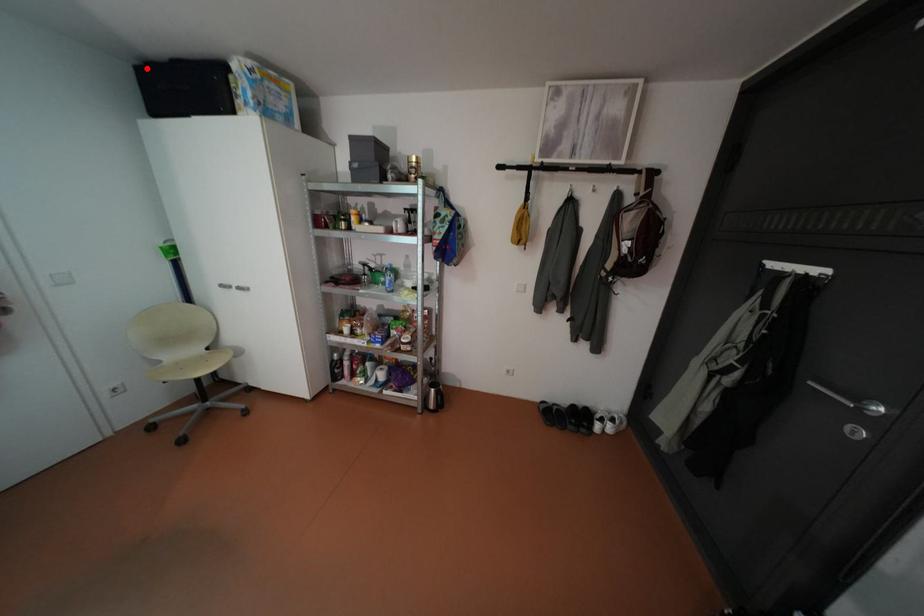
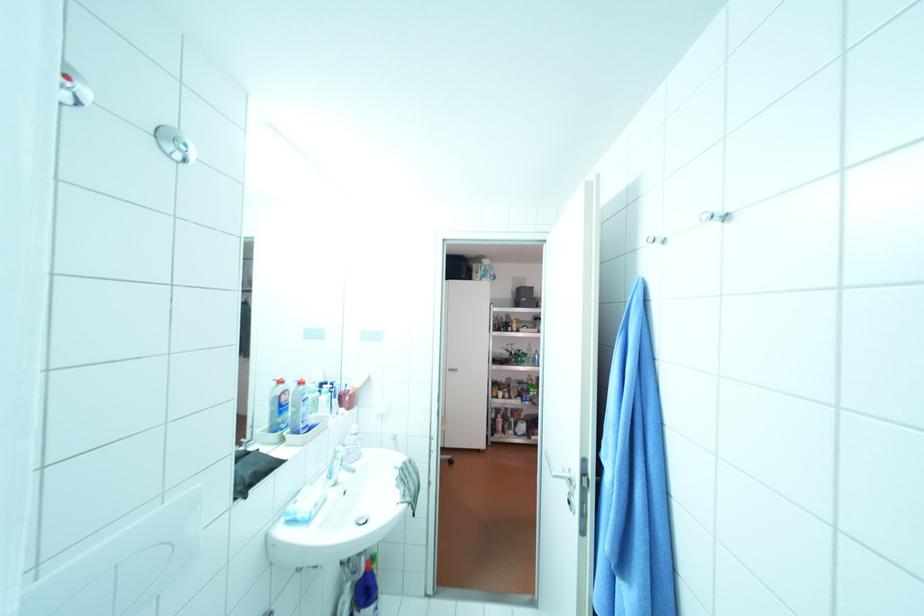
Question: I am providing you with two images of the same scene from different viewpoints. A red point is marked on the first image. Can you still see the location of the red point in image 2?

Choices:
 (A) Yes
 (B) No

Answer: (B)